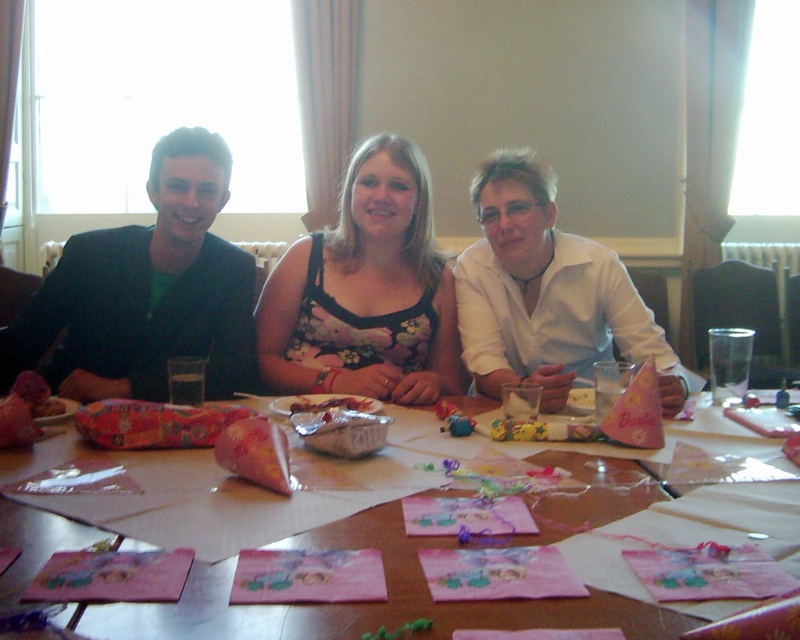
Is point (388, 145) farther from camera compared to point (332, 396)?

Yes, it is behind point (332, 396).

Between floral fabric dress at center and translucent plastic bag at center, which one appears on the left side from the viewer's perspective?

translucent plastic bag at center

Which is in front, point (344, 234) or point (362, 410)?

Point (362, 410) is more forward.

Locate an element on the screen. Image resolution: width=800 pixels, height=640 pixels. floral fabric dress at center is located at coordinates (366, 291).

Who is positioned more to the right, floral fabric dress at center or white glossy shirt at upper center?

white glossy shirt at upper center is more to the right.

Is floral fabric dress at center to the right of white glossy shirt at upper center from the viewer's perspective?

Incorrect, floral fabric dress at center is not on the right side of white glossy shirt at upper center.

Between point (264, 378) and point (488, 260), which one is positioned in front?

Point (264, 378) is in front.

Where is `floral fabric dress at center`? The height and width of the screenshot is (640, 800). floral fabric dress at center is located at coordinates (366, 291).

Between black matte jacket at left and white glossy shirt at upper center, which one has more height?

Standing taller between the two is black matte jacket at left.

Does black matte jacket at left appear over white glossy shirt at upper center?

Indeed, black matte jacket at left is positioned over white glossy shirt at upper center.

Is point (94, 257) positioned behind point (522, 218)?

Yes, point (94, 257) is behind point (522, 218).

Where is `black matte jacket at left`? black matte jacket at left is located at coordinates (146, 291).